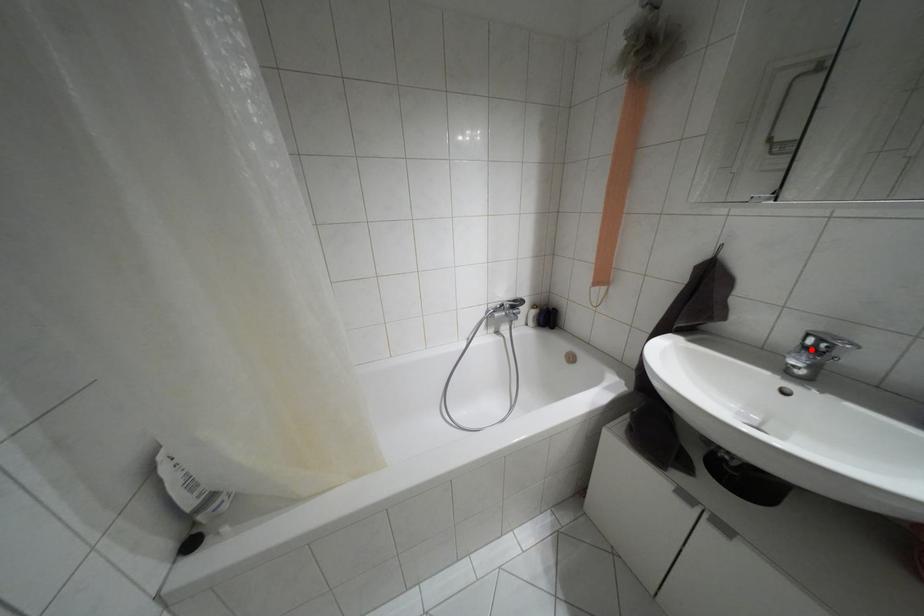
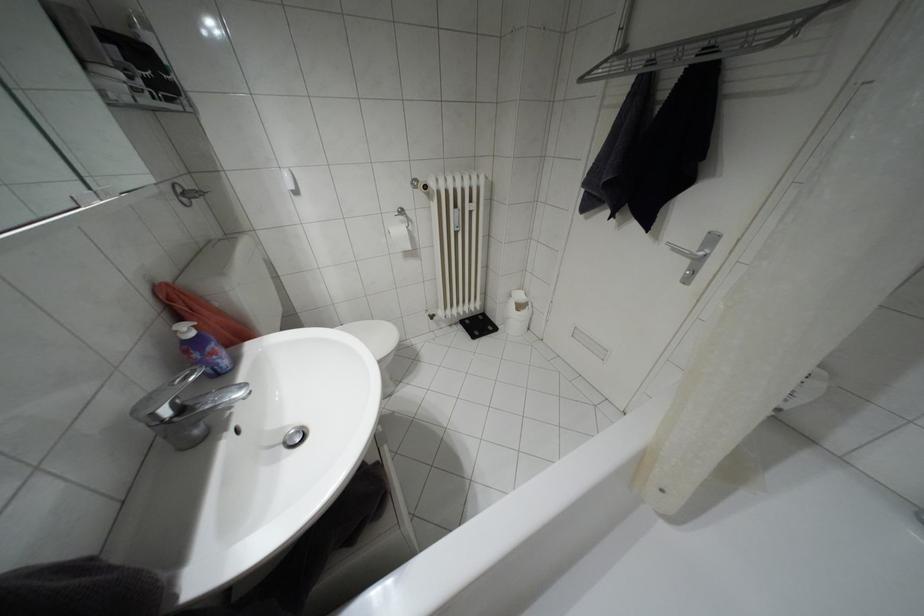
The point at the highlighted location is marked in the first image. Where is the corresponding point in the second image?

(180, 408)